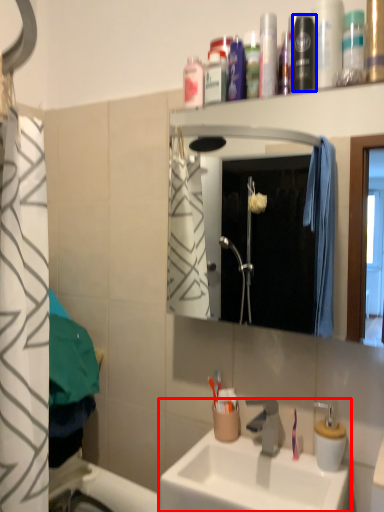
Question: Which object is further to the camera taking this photo, sink (highlighted by a red box) or mouthwash (highlighted by a blue box)?

Choices:
 (A) sink
 (B) mouthwash

Answer: (B)